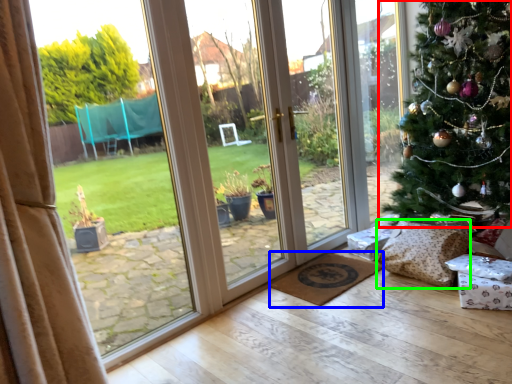
Question: Which object is the closest to the christmas tree (highlighted by a red box)? Choose among these: doormat (highlighted by a blue box) or pillow (highlighted by a green box).

Choices:
 (A) doormat
 (B) pillow

Answer: (B)